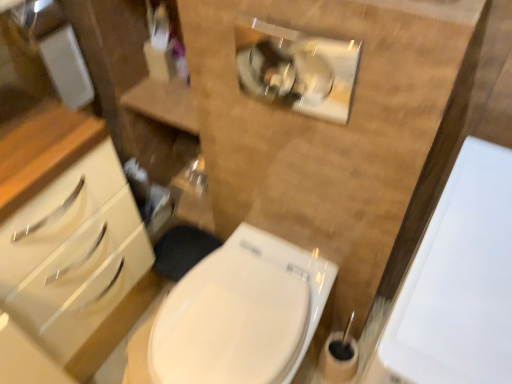
Where is `free space above white glossy toilet at center (from a real-world perspective)`? free space above white glossy toilet at center (from a real-world perspective) is located at coordinates (232, 317).